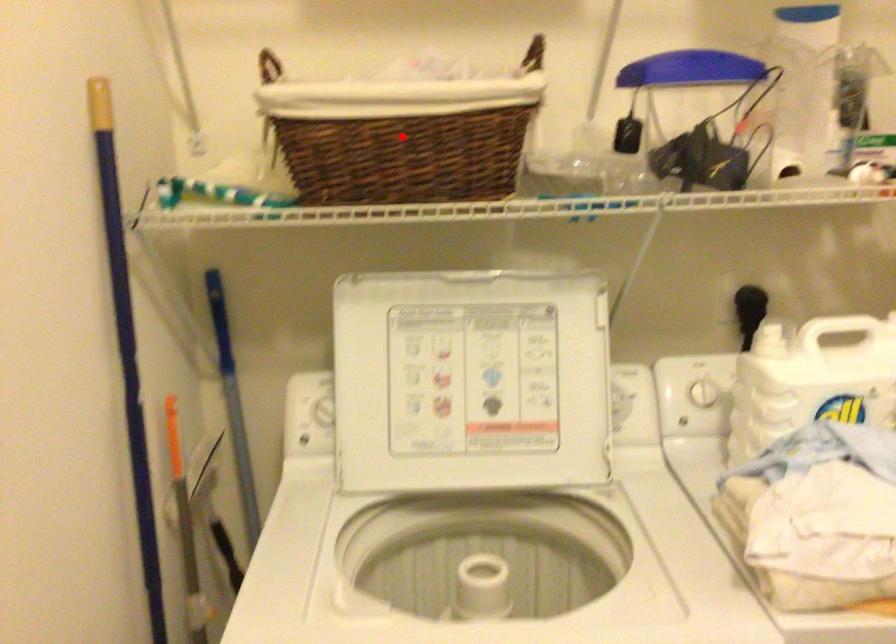
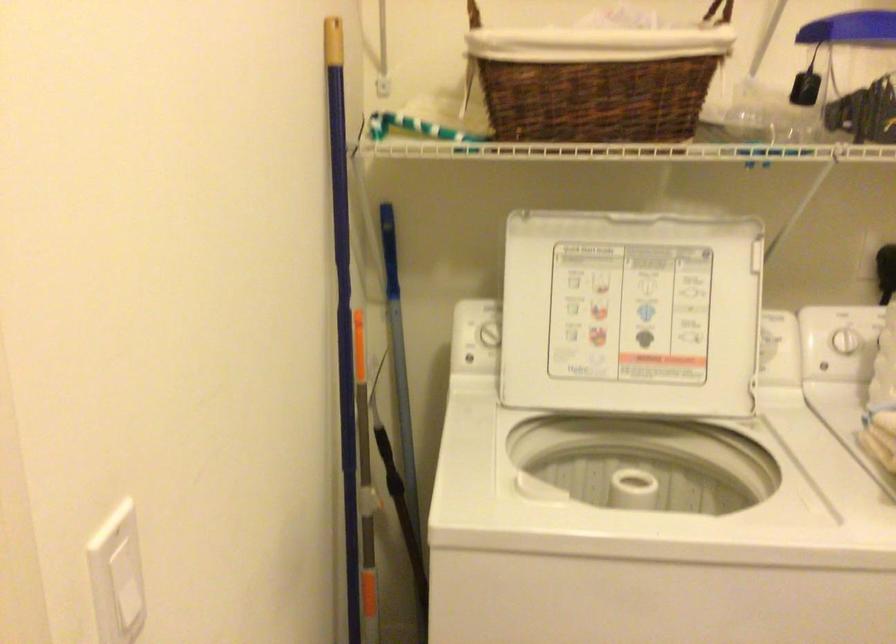
Question: I am providing you with two images of the same scene from different viewpoints. A red point is shown in image1. For the corresponding object point in image2, is it positioned nearer or farther from the camera?

Choices:
 (A) Nearer
 (B) Farther

Answer: (B)